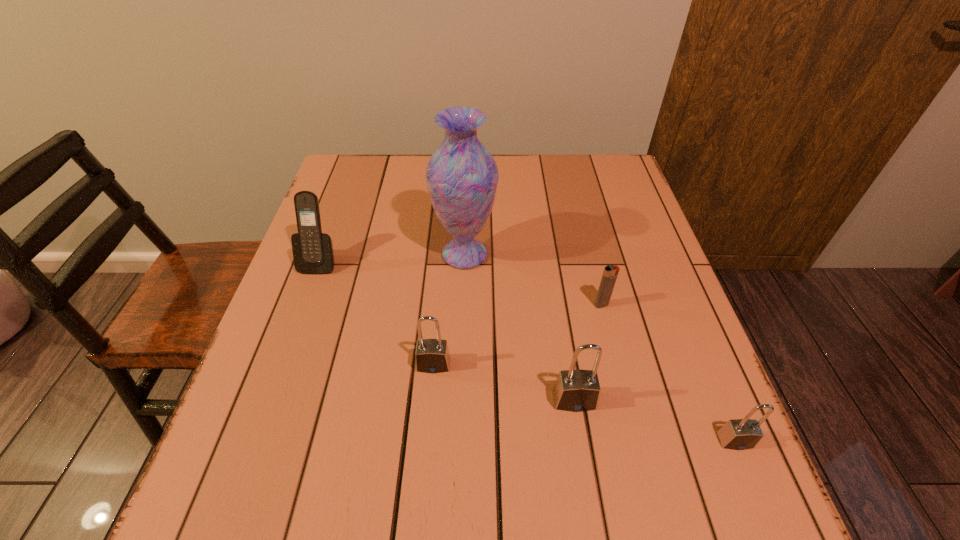
Locate an element on the screen. The height and width of the screenshot is (540, 960). free space that is in between the second tallest padlock and the second nearest padlock is located at coordinates (504, 382).

You are a GUI agent. You are given a task and a screenshot of the screen. Output one action in this format:
    pyautogui.click(x=<x>, y=<y>)
    Task: Click on the free area in between the third shortest object and the igniter
    This screenshot has width=960, height=540.
    Given the screenshot: What is the action you would take?
    pyautogui.click(x=517, y=334)

Select which object appears as the second closest to the third object from right to left. Please provide its 2D coordinates. Your answer should be formatted as a tuple, i.e. [(x, y)], where the tuple contains the x and y coordinates of a point satisfying the conditions above.

[(610, 273)]

Select which object is the third closest to the second object from right to left. Please provide its 2D coordinates. Your answer should be formatted as a tuple, i.e. [(x, y)], where the tuple contains the x and y coordinates of a point satisfying the conditions above.

[(739, 434)]

Locate which padlock ranks third in proximity to the tallest object. Please provide its 2D coordinates. Your answer should be formatted as a tuple, i.e. [(x, y)], where the tuple contains the x and y coordinates of a point satisfying the conditions above.

[(739, 434)]

At what (x,y) coordinates should I click in order to perform the action: click on padlock that is the second closest to the second nearest padlock. Please return your answer as a coordinate pair (x, y). This screenshot has width=960, height=540. Looking at the image, I should click on (739, 434).